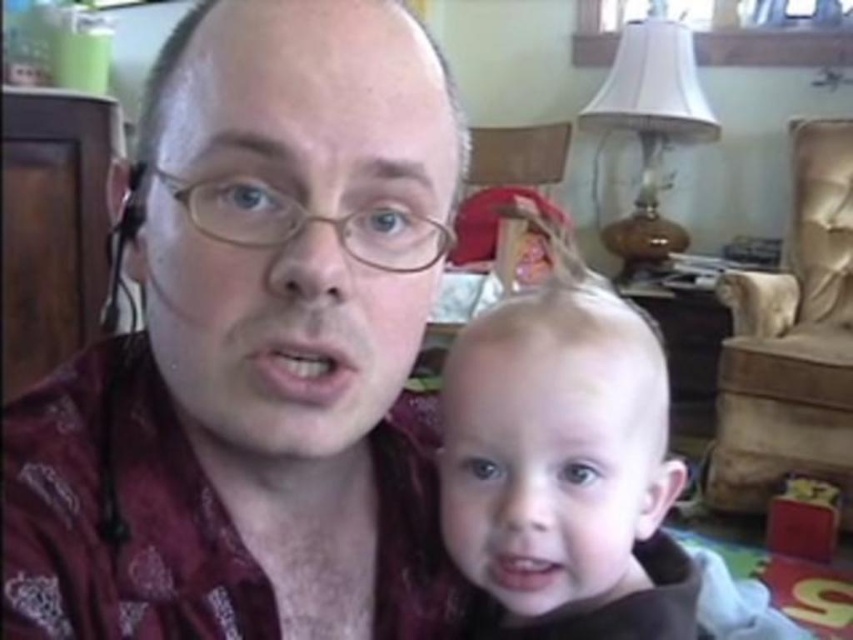
Please provide the 2D coordinates of the maroon patterned shirt at center in the image. The coordinates should be in the format of a tuple with two decimal numbers separated by a comma, enclosed in parentheses. For example, if the coordinates are 0.5 and 0.3, the answer would be written as the tuple value of the coordinates. Please do not add any additional text or explanation.

The 2D coordinates of the maroon patterned shirt at center are at point (254, 349).